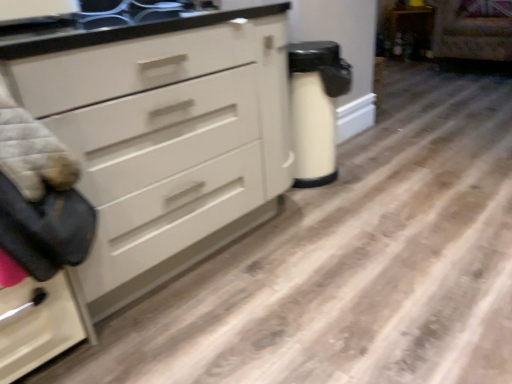
Describe the element at coordinates (473, 30) in the screenshot. The image size is (512, 384). I see `velvet-like beige armchair at upper right` at that location.

The image size is (512, 384). What do you see at coordinates (154, 151) in the screenshot?
I see `white matte chest of drawers at center` at bounding box center [154, 151].

Image resolution: width=512 pixels, height=384 pixels. What do you see at coordinates (409, 31) in the screenshot?
I see `wooden cabinet at upper right` at bounding box center [409, 31].

Identify the location of velvet-like beige armchair at upper right. This screenshot has height=384, width=512. (473, 30).

Where is `chest of drawers on the left of velvet-like beige armchair at upper right`? chest of drawers on the left of velvet-like beige armchair at upper right is located at coordinates (154, 151).

Do you think velvet-like beige armchair at upper right is within white matte chest of drawers at center, or outside of it?

velvet-like beige armchair at upper right is spatially situated outside white matte chest of drawers at center.

Considering the relative sizes of velvet-like beige armchair at upper right and white matte chest of drawers at center in the image provided, is velvet-like beige armchair at upper right thinner than white matte chest of drawers at center?

No, velvet-like beige armchair at upper right is not thinner than white matte chest of drawers at center.

Is point (492, 18) closer or farther from the camera than point (226, 242)?

Point (492, 18) is farther from the camera than point (226, 242).

Would you say velvet-like beige armchair at upper right is a long distance from wooden cabinet at upper right?

No, there isn't a large distance between velvet-like beige armchair at upper right and wooden cabinet at upper right.

What's the angular difference between velvet-like beige armchair at upper right and wooden cabinet at upper right's facing directions?

There is a 34.9-degree angle between the facing directions of velvet-like beige armchair at upper right and wooden cabinet at upper right.

From a real-world perspective, which object stands above the other?

velvet-like beige armchair at upper right.

Measure the distance from velvet-like beige armchair at upper right to wooden cabinet at upper right.

velvet-like beige armchair at upper right and wooden cabinet at upper right are 18.07 inches apart from each other.

Which object is closer to the camera, velvet-like beige armchair at upper right or black glossy sink at upper center?

black glossy sink at upper center is closer to the camera.

In terms of width, does velvet-like beige armchair at upper right look wider or thinner when compared to black glossy sink at upper center?

velvet-like beige armchair at upper right is wider than black glossy sink at upper center.

How much distance is there between velvet-like beige armchair at upper right and black glossy sink at upper center?

The distance of velvet-like beige armchair at upper right from black glossy sink at upper center is 3.13 meters.

Is point (476, 52) behind point (129, 11)?

Yes, it is behind point (129, 11).

Considering the relative positions of wooden cabinet at upper right and black glossy sink at upper center in the image provided, is wooden cabinet at upper right to the left of black glossy sink at upper center from the viewer's perspective?

No.

Considering the sizes of objects wooden cabinet at upper right and black glossy sink at upper center in the image provided, who is bigger, wooden cabinet at upper right or black glossy sink at upper center?

Bigger between the two is wooden cabinet at upper right.

Is black glossy sink at upper center at the right side of wooden cabinet at upper right?

Incorrect, black glossy sink at upper center is not on the right side of wooden cabinet at upper right.

Measure the distance from black glossy sink at upper center to wooden cabinet at upper right.

They are 3.30 meters apart.

How many degrees apart are the facing directions of black glossy sink at upper center and wooden cabinet at upper right?

They differ by 49.7 degrees in their facing directions.

What are the coordinates of `sink in front of the wooden cabinet at upper right` in the screenshot? It's located at (140, 12).

Is wooden cabinet at upper right looking in the opposite direction of white matte chest of drawers at center?

No, white matte chest of drawers at center is not at the back of wooden cabinet at upper right.

The height and width of the screenshot is (384, 512). In order to click on cabinetry behind the white matte chest of drawers at center in this screenshot , I will do `click(409, 31)`.

Is wooden cabinet at upper right closer to the viewer compared to white matte chest of drawers at center?

No, wooden cabinet at upper right is further to the viewer.

How different are the orientations of wooden cabinet at upper right and white matte chest of drawers at center in degrees?

The facing directions of wooden cabinet at upper right and white matte chest of drawers at center are 50.1 degrees apart.

In terms of size, does white matte chest of drawers at center appear bigger or smaller than velvet-like beige armchair at upper right?

Considering their sizes, white matte chest of drawers at center takes up more space than velvet-like beige armchair at upper right.

Which is more to the left, white matte chest of drawers at center or velvet-like beige armchair at upper right?

Positioned to the left is white matte chest of drawers at center.

Is there a large distance between white matte chest of drawers at center and velvet-like beige armchair at upper right?

white matte chest of drawers at center is positioned a significant distance from velvet-like beige armchair at upper right.

The width and height of the screenshot is (512, 384). What are the coordinates of `the chest of drawers that is below the velvet-like beige armchair at upper right (from the image's perspective)` in the screenshot? It's located at (154, 151).

Where is `cabinetry located underneath the velvet-like beige armchair at upper right (from a real-world perspective)`? cabinetry located underneath the velvet-like beige armchair at upper right (from a real-world perspective) is located at coordinates (409, 31).

From the image, which object appears to be nearer to wooden cabinet at upper right, black glossy sink at upper center or velvet-like beige armchair at upper right?

velvet-like beige armchair at upper right is closer to wooden cabinet at upper right.

From the image, which object appears to be farther from white matte chest of drawers at center, wooden cabinet at upper right or velvet-like beige armchair at upper right?

The object further to white matte chest of drawers at center is wooden cabinet at upper right.

Estimate the real-world distances between objects in this image. Which object is closer to black glossy sink at upper center, velvet-like beige armchair at upper right or white matte chest of drawers at center?

white matte chest of drawers at center lies closer to black glossy sink at upper center than the other object.

When comparing their distances from wooden cabinet at upper right, does white matte chest of drawers at center or velvet-like beige armchair at upper right seem closer?

velvet-like beige armchair at upper right.

Based on their spatial positions, is black glossy sink at upper center or white matte chest of drawers at center further from velvet-like beige armchair at upper right?

Among the two, white matte chest of drawers at center is located further to velvet-like beige armchair at upper right.

Considering their positions, is black glossy sink at upper center positioned further to white matte chest of drawers at center than velvet-like beige armchair at upper right?

velvet-like beige armchair at upper right is positioned further to the anchor white matte chest of drawers at center.

Considering their positions, is wooden cabinet at upper right positioned further to black glossy sink at upper center than velvet-like beige armchair at upper right?

wooden cabinet at upper right is positioned further to the anchor black glossy sink at upper center.

Estimate the real-world distances between objects in this image. Which object is further from velvet-like beige armchair at upper right, wooden cabinet at upper right or white matte chest of drawers at center?

white matte chest of drawers at center.

I want to click on armchair between black glossy sink at upper center and wooden cabinet at upper right from front to back, so click(x=473, y=30).

Find the location of a particular element. chest of drawers between black glossy sink at upper center and velvet-like beige armchair at upper right in the horizontal direction is located at coordinates (154, 151).

At what (x,y) coordinates should I click in order to perform the action: click on armchair located between white matte chest of drawers at center and wooden cabinet at upper right in the depth direction. Please return your answer as a coordinate pair (x, y). Image resolution: width=512 pixels, height=384 pixels. Looking at the image, I should click on point(473,30).

This screenshot has width=512, height=384. In order to click on sink located between white matte chest of drawers at center and wooden cabinet at upper right in the depth direction in this screenshot , I will do `click(140, 12)`.